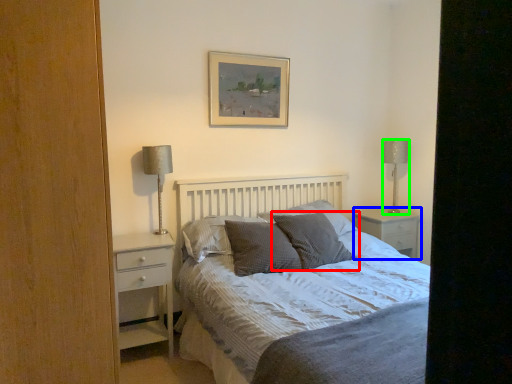
Question: Which is farther away from pillow (highlighted by a red box)? nightstand (highlighted by a blue box) or table lamp (highlighted by a green box)?

Choices:
 (A) nightstand
 (B) table lamp

Answer: (B)